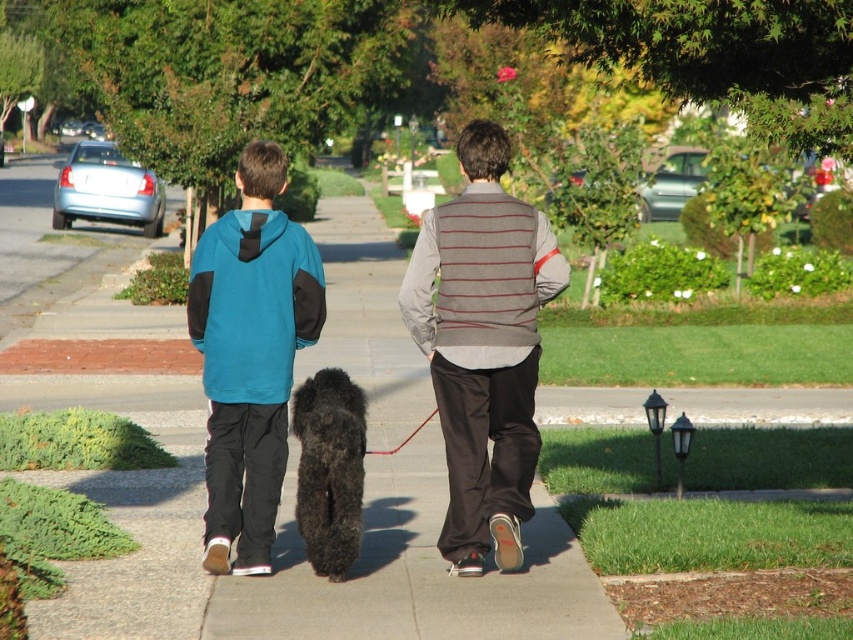
Does striped knit vest at center have a smaller size compared to black fuzzy dog at center?

No, striped knit vest at center is not smaller than black fuzzy dog at center.

Does striped knit vest at center have a lesser width compared to black fuzzy dog at center?

No, striped knit vest at center is not thinner than black fuzzy dog at center.

Which is in front, point (531, 220) or point (316, 451)?

Point (531, 220) is more forward.

This screenshot has width=853, height=640. I want to click on striped knit vest at center, so click(x=483, y=346).

Locate an element on the screen. This screenshot has width=853, height=640. black asphalt sidewalk at center is located at coordinates (415, 573).

Does black asphalt sidewalk at center have a lesser height compared to teal fleece hoodie at center?

In fact, black asphalt sidewalk at center may be taller than teal fleece hoodie at center.

Who is more forward, (426, 525) or (213, 515)?

Point (213, 515) is more forward.

At what (x,y) coordinates should I click in order to perform the action: click on black asphalt sidewalk at center. Please return your answer as a coordinate pair (x, y). Image resolution: width=853 pixels, height=640 pixels. Looking at the image, I should click on (415, 573).

Which is more to the left, black asphalt sidewalk at center or black fuzzy dog at center?

black fuzzy dog at center is more to the left.

Is point (337, 326) positioned behind point (329, 388)?

That is True.

At what (x,y) coordinates should I click in order to perform the action: click on black asphalt sidewalk at center. Please return your answer as a coordinate pair (x, y). The height and width of the screenshot is (640, 853). Looking at the image, I should click on (415, 573).